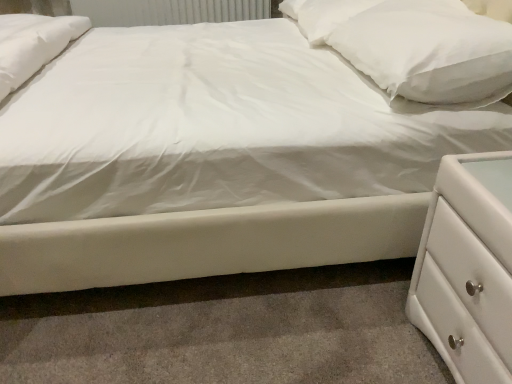
Question: Could you tell me if white textured radiator at upper center is facing white soft pillow at upper right, which ranks as the 2th pillow in front-to-back order?

Choices:
 (A) no
 (B) yes

Answer: (B)

Question: Would you say white soft pillow at upper right, which ranks as the 2th pillow in front-to-back order, is part of white textured radiator at upper center's contents?

Choices:
 (A) no
 (B) yes

Answer: (A)

Question: From the image's perspective, is white textured radiator at upper center on white soft pillow at upper right, which ranks as the 2th pillow in front-to-back order?

Choices:
 (A) no
 (B) yes

Answer: (B)

Question: From a real-world perspective, is white textured radiator at upper center positioned over white soft pillow at upper right, which ranks as the 2th pillow in front-to-back order, based on gravity?

Choices:
 (A) no
 (B) yes

Answer: (A)

Question: Is white textured radiator at upper center not within white soft pillow at upper right, which ranks as the 2th pillow in front-to-back order?

Choices:
 (A) no
 (B) yes

Answer: (B)

Question: In the image, is white textured radiator at upper center positioned in front of or behind white glossy chest of drawers at lower right?

Choices:
 (A) behind
 (B) front

Answer: (A)

Question: Considering the positions of white textured radiator at upper center and white glossy chest of drawers at lower right in the image, is white textured radiator at upper center wider or thinner than white glossy chest of drawers at lower right?

Choices:
 (A) thin
 (B) wide

Answer: (A)

Question: Based on their positions, is white textured radiator at upper center located to the left or right of white glossy chest of drawers at lower right?

Choices:
 (A) left
 (B) right

Answer: (A)

Question: From the image's perspective, is white textured radiator at upper center positioned above or below white glossy chest of drawers at lower right?

Choices:
 (A) above
 (B) below

Answer: (A)

Question: Is white soft pillow at upper right, the 2th pillow when ordered from back to front, to the left or to the right of white soft pillow at upper right, which ranks as the 2th pillow in front-to-back order, in the image?

Choices:
 (A) right
 (B) left

Answer: (A)

Question: Do you think white soft pillow at upper right, the 2th pillow when ordered from back to front, is within white soft pillow at upper right, which ranks as the 2th pillow in front-to-back order, or outside of it?

Choices:
 (A) inside
 (B) outside

Answer: (B)

Question: From the image's perspective, is white soft pillow at upper right, the 2th pillow when ordered from back to front, located above or below white soft pillow at upper right, which ranks as the 2th pillow in front-to-back order?

Choices:
 (A) above
 (B) below

Answer: (B)

Question: Considering the positions of white soft pillow at upper right, the 2th pillow when ordered from back to front, and white soft pillow at upper right, which ranks as the 2th pillow in front-to-back order, in the image, is white soft pillow at upper right, the 2th pillow when ordered from back to front, bigger or smaller than white soft pillow at upper right, which ranks as the 2th pillow in front-to-back order,?

Choices:
 (A) big
 (B) small

Answer: (A)

Question: Is point (334, 14) positioned closer to the camera than point (105, 24)?

Choices:
 (A) closer
 (B) farther

Answer: (A)

Question: Looking at the image, does white soft pillow at upper right, the 1th pillow in the back-to-front sequence, seem bigger or smaller compared to white textured radiator at upper center?

Choices:
 (A) small
 (B) big

Answer: (A)